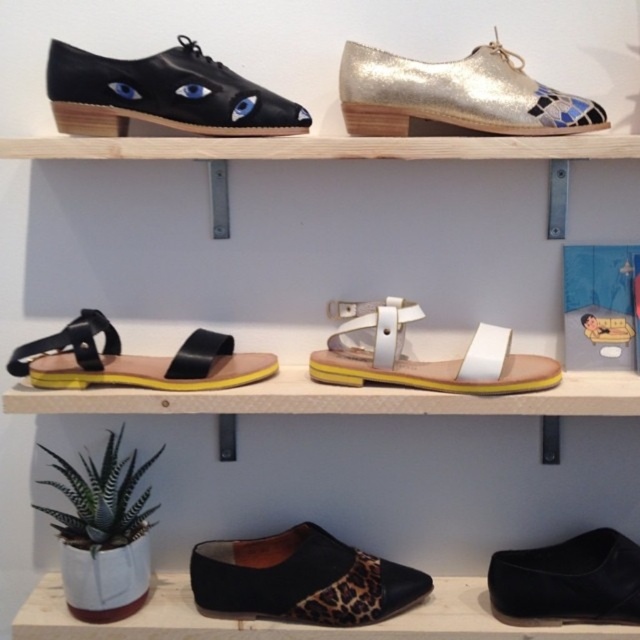
From the picture: Is leopard print fabric slip-on at lower center thinner than white leather sandal at center?

Correct, leopard print fabric slip-on at lower center's width is less than white leather sandal at center's.

Measure the distance from leopard print fabric slip-on at lower center to white leather sandal at center.

leopard print fabric slip-on at lower center is 15.06 inches away from white leather sandal at center.

Where is `leopard print fabric slip-on at lower center`? The height and width of the screenshot is (640, 640). leopard print fabric slip-on at lower center is located at coordinates (301, 579).

Which is behind, point (369, 120) or point (444, 362)?

Positioned behind is point (444, 362).

Is point (531, 97) more distant than point (490, 378)?

No, it is not.

Where is `glittery metallic shoe at upper center`? This screenshot has height=640, width=640. glittery metallic shoe at upper center is located at coordinates (456, 93).

The image size is (640, 640). Identify the location of glittery metallic shoe at upper center. (456, 93).

Does glittery metallic shoe at upper center have a greater width compared to leopard print fabric slip-on at lower center?

Yes.

Can you confirm if glittery metallic shoe at upper center is taller than leopard print fabric slip-on at lower center?

Yes.

Image resolution: width=640 pixels, height=640 pixels. Describe the element at coordinates (456, 93) in the screenshot. I see `glittery metallic shoe at upper center` at that location.

You are a GUI agent. You are given a task and a screenshot of the screen. Output one action in this format:
    pyautogui.click(x=<x>, y=<y>)
    Task: Click on the glittery metallic shoe at upper center
    
    Given the screenshot: What is the action you would take?
    pyautogui.click(x=456, y=93)